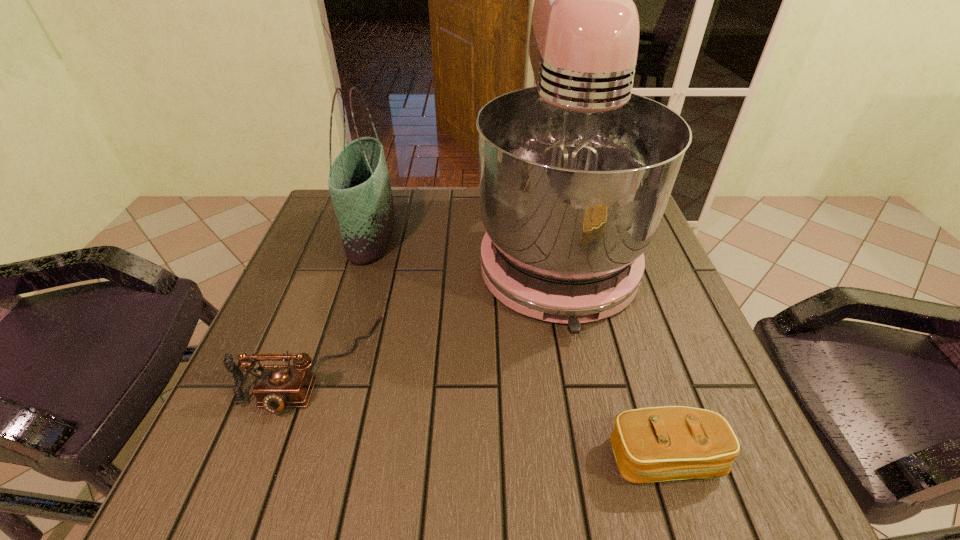
You are a GUI agent. You are given a task and a screenshot of the screen. Output one action in this format:
    pyautogui.click(x=<x>, y=<y>)
    Task: Click on the mixer
    The image size is (960, 540).
    Given the screenshot: What is the action you would take?
    pyautogui.click(x=575, y=173)

You are a GUI agent. You are given a task and a screenshot of the screen. Output one action in this format:
    pyautogui.click(x=<x>, y=<y>)
    Task: Click on the tote bag
    
    Given the screenshot: What is the action you would take?
    pyautogui.click(x=359, y=183)

Find the location of a particular element. This screenshot has height=540, width=960. the second shortest object is located at coordinates (277, 386).

Locate an element on the screen. The height and width of the screenshot is (540, 960). clutch bag is located at coordinates (654, 444).

Identify the location of the nearest object. (654, 444).

At what (x,y) coordinates should I click in order to perform the action: click on vacant region located on the front-facing side of the mixer. Please return your answer as a coordinate pair (x, y). Looking at the image, I should click on (599, 470).

Where is `free space located 0.070m on the left of the second tallest object`? free space located 0.070m on the left of the second tallest object is located at coordinates (322, 234).

At what (x,y) coordinates should I click in order to perform the action: click on free spot located on the dial of the telephone. Please return your answer as a coordinate pair (x, y). This screenshot has width=960, height=540. Looking at the image, I should click on (269, 487).

Find the location of a particular element. This screenshot has width=960, height=540. mixer present at the far edge is located at coordinates (575, 173).

Image resolution: width=960 pixels, height=540 pixels. In order to click on tote bag located at the far edge in this screenshot , I will do `click(359, 183)`.